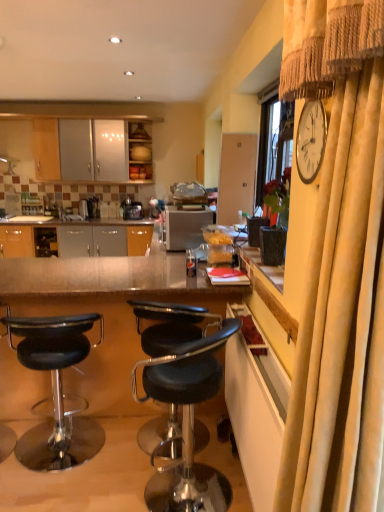
Question: Does metallic/reflective table at center have a greater height compared to black leather stool at lower left, placed as the 2th chair when sorted from right to left?

Choices:
 (A) no
 (B) yes

Answer: (B)

Question: Could black leather stool at lower left, arranged as the 1th chair when viewed from the left, be considered to be inside metallic/reflective table at center?

Choices:
 (A) no
 (B) yes

Answer: (B)

Question: From a real-world perspective, is metallic/reflective table at center located beneath black leather stool at lower left, placed as the 2th chair when sorted from right to left?

Choices:
 (A) no
 (B) yes

Answer: (A)

Question: Is metallic/reflective table at center bigger than black leather stool at lower left, placed as the 2th chair when sorted from right to left?

Choices:
 (A) no
 (B) yes

Answer: (B)

Question: From the image's perspective, is metallic/reflective table at center located beneath black leather stool at lower left, placed as the 2th chair when sorted from right to left?

Choices:
 (A) yes
 (B) no

Answer: (B)

Question: Can you confirm if metallic/reflective table at center is shorter than black leather stool at lower left, placed as the 2th chair when sorted from right to left?

Choices:
 (A) no
 (B) yes

Answer: (A)

Question: Does yellow wood cabinet at right, which is the 1th cabinetry in front-to-back order, have a lesser height compared to satin black coffee machine at center, placed as the 1th coffee machine when sorted from left to right?

Choices:
 (A) no
 (B) yes

Answer: (A)

Question: Considering the relative sizes of yellow wood cabinet at right, the 2th cabinetry viewed from the left, and satin black coffee machine at center, placed as the 1th coffee machine when sorted from left to right, in the image provided, is yellow wood cabinet at right, the 2th cabinetry viewed from the left, wider than satin black coffee machine at center, placed as the 1th coffee machine when sorted from left to right,?

Choices:
 (A) yes
 (B) no

Answer: (B)

Question: Considering the relative sizes of yellow wood cabinet at right, positioned as the 1th cabinetry in bottom-to-top order, and satin black coffee machine at center, placed as the second coffee machine when sorted from right to left, in the image provided, is yellow wood cabinet at right, positioned as the 1th cabinetry in bottom-to-top order, smaller than satin black coffee machine at center, placed as the second coffee machine when sorted from right to left,?

Choices:
 (A) no
 (B) yes

Answer: (A)

Question: Is yellow wood cabinet at right, positioned as the 1th cabinetry in bottom-to-top order, placed right next to satin black coffee machine at center, placed as the 1th coffee machine when sorted from left to right?

Choices:
 (A) no
 (B) yes

Answer: (A)

Question: From a real-world perspective, is yellow wood cabinet at right, which is the 1th cabinetry in front-to-back order, positioned over satin black coffee machine at center, placed as the second coffee machine when sorted from right to left, based on gravity?

Choices:
 (A) no
 (B) yes

Answer: (A)

Question: Are yellow wood cabinet at right, marked as the second cabinetry in a back-to-front arrangement, and satin black coffee machine at center, placed as the 1th coffee machine when sorted from left to right, far apart?

Choices:
 (A) yes
 (B) no

Answer: (A)

Question: From a real-world perspective, is velvet beige curtain at right below satin black coffee machine at center, placed as the 1th coffee machine when sorted from left to right?

Choices:
 (A) no
 (B) yes

Answer: (A)